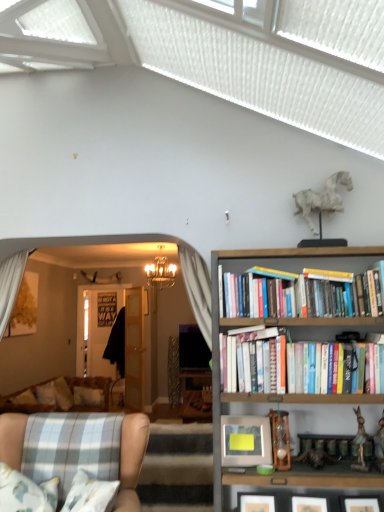
Question: Is metallic silver picture frame at right positioned in front of wooden bookshelf at upper right?

Choices:
 (A) no
 (B) yes

Answer: (A)

Question: Does metallic silver picture frame at right appear on the right side of wooden bookshelf at upper right?

Choices:
 (A) yes
 (B) no

Answer: (B)

Question: Is wooden bookshelf at upper right completely or partially inside metallic silver picture frame at right?

Choices:
 (A) no
 (B) yes

Answer: (A)

Question: Can you confirm if metallic silver picture frame at right is shorter than wooden bookshelf at upper right?

Choices:
 (A) no
 (B) yes

Answer: (B)

Question: Does metallic silver picture frame at right have a smaller size compared to wooden bookshelf at upper right?

Choices:
 (A) no
 (B) yes

Answer: (B)

Question: Is metallic silver picture frame at right taller than wooden bookshelf at upper right?

Choices:
 (A) no
 (B) yes

Answer: (A)

Question: Is crystal chandelier at center positioned far away from wooden bookshelf at upper right?

Choices:
 (A) yes
 (B) no

Answer: (A)

Question: Can you confirm if crystal chandelier at center is positioned to the left of wooden bookshelf at upper right?

Choices:
 (A) yes
 (B) no

Answer: (A)

Question: From a real-world perspective, is crystal chandelier at center on top of wooden bookshelf at upper right?

Choices:
 (A) no
 (B) yes

Answer: (B)

Question: Is crystal chandelier at center thinner than wooden bookshelf at upper right?

Choices:
 (A) no
 (B) yes

Answer: (A)

Question: From the image's perspective, would you say crystal chandelier at center is shown under wooden bookshelf at upper right?

Choices:
 (A) no
 (B) yes

Answer: (A)

Question: Is crystal chandelier at center facing away from wooden bookshelf at upper right?

Choices:
 (A) no
 (B) yes

Answer: (A)

Question: Is wooden bookshelf at upper right turned away from plaid fabric armchair at lower left?

Choices:
 (A) no
 (B) yes

Answer: (A)